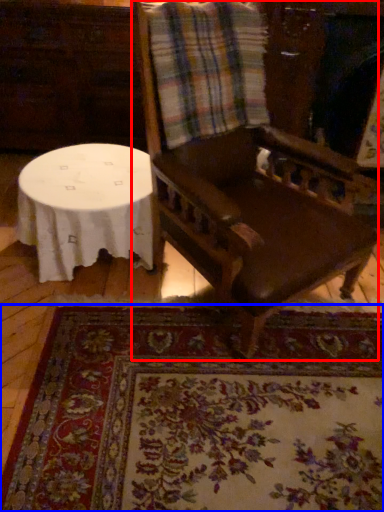
Question: Which object is closer to the camera taking this photo, chair (highlighted by a red box) or mat (highlighted by a blue box)?

Choices:
 (A) chair
 (B) mat

Answer: (A)